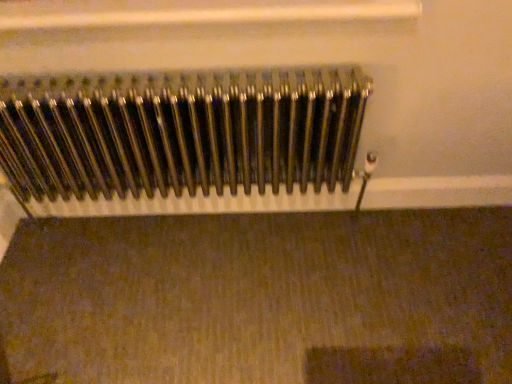
The height and width of the screenshot is (384, 512). Describe the element at coordinates (181, 132) in the screenshot. I see `metallic radiator at center` at that location.

Identify the location of metallic radiator at center. This screenshot has width=512, height=384. (181, 132).

Measure the distance between point (x=12, y=126) and camera.

The depth of point (x=12, y=126) is 1.26 meters.

I want to click on metallic radiator at center, so click(181, 132).